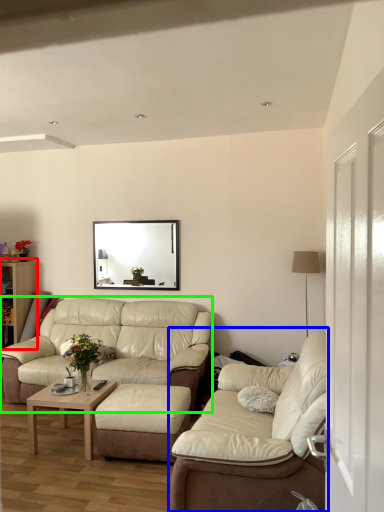
Question: Considering the real-world distances, which object is closest to dresser (highlighted by a red box)? studio couch (highlighted by a blue box) or studio couch (highlighted by a green box).

Choices:
 (A) studio couch
 (B) studio couch

Answer: (B)